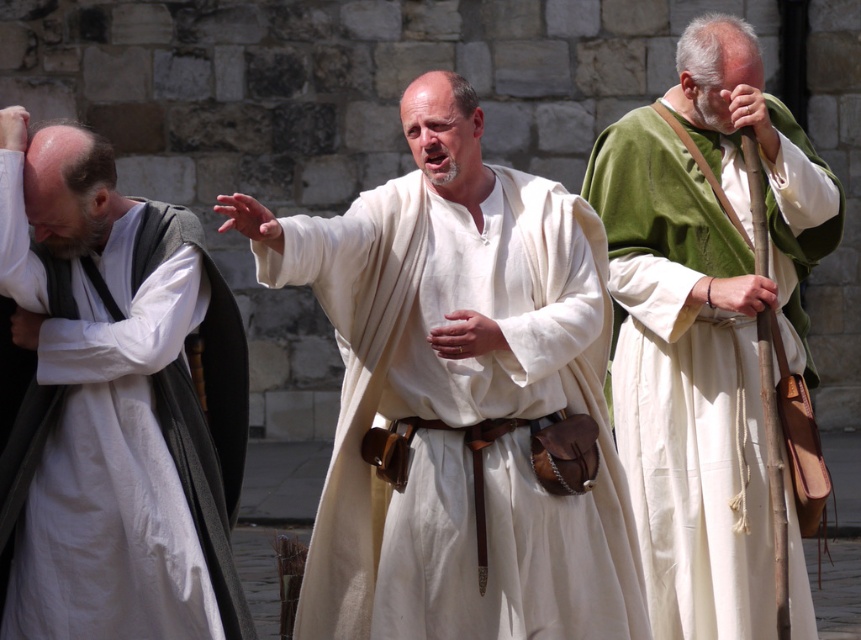
Question: Which of these objects is positioned farthest from the green velvet robe at right?

Choices:
 (A) white clothed robe at center
 (B) white linen robe at left

Answer: (B)

Question: Can you confirm if white clothed robe at center is positioned to the left of green velvet robe at right?

Choices:
 (A) no
 (B) yes

Answer: (B)

Question: Which point is closer to the camera?

Choices:
 (A) white linen robe at left
 (B) white clothed robe at center
 (C) green velvet robe at right

Answer: (B)

Question: Is white clothed robe at center further to the viewer compared to green velvet robe at right?

Choices:
 (A) no
 (B) yes

Answer: (A)

Question: Is white linen robe at left above green velvet robe at right?

Choices:
 (A) no
 (B) yes

Answer: (A)

Question: Which object appears closest to the camera in this image?

Choices:
 (A) white linen robe at left
 (B) green velvet robe at right
 (C) white clothed robe at center

Answer: (C)